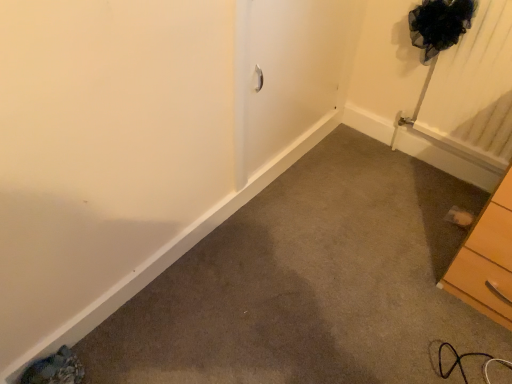
Question: Is wooden chest of drawers at lower right inside or outside of silver metallic screen door at center?

Choices:
 (A) outside
 (B) inside

Answer: (A)

Question: Looking at their shapes, would you say wooden chest of drawers at lower right is wider or thinner than silver metallic screen door at center?

Choices:
 (A) thin
 (B) wide

Answer: (B)

Question: From the image's perspective, is wooden chest of drawers at lower right above or below silver metallic screen door at center?

Choices:
 (A) below
 (B) above

Answer: (A)

Question: Does point (323, 109) appear closer or farther from the camera than point (492, 271)?

Choices:
 (A) closer
 (B) farther

Answer: (B)

Question: From the image's perspective, is silver metallic screen door at center positioned above or below wooden chest of drawers at lower right?

Choices:
 (A) below
 (B) above

Answer: (B)

Question: Is silver metallic screen door at center taller or shorter than wooden chest of drawers at lower right?

Choices:
 (A) tall
 (B) short

Answer: (A)

Question: Do you think silver metallic screen door at center is within wooden chest of drawers at lower right, or outside of it?

Choices:
 (A) inside
 (B) outside

Answer: (B)